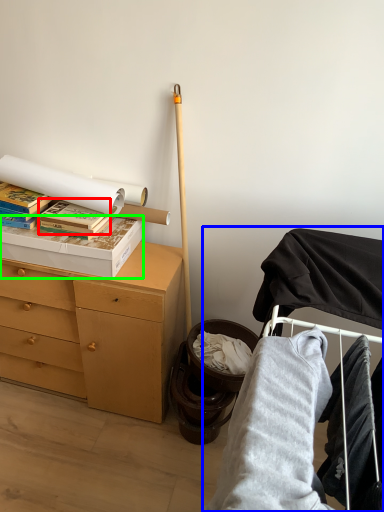
Question: Estimate the real-world distances between objects in this image. Which object is closer to paperback book (highlighted by a red box), bunk bed (highlighted by a blue box) or box (highlighted by a green box)?

Choices:
 (A) bunk bed
 (B) box

Answer: (B)